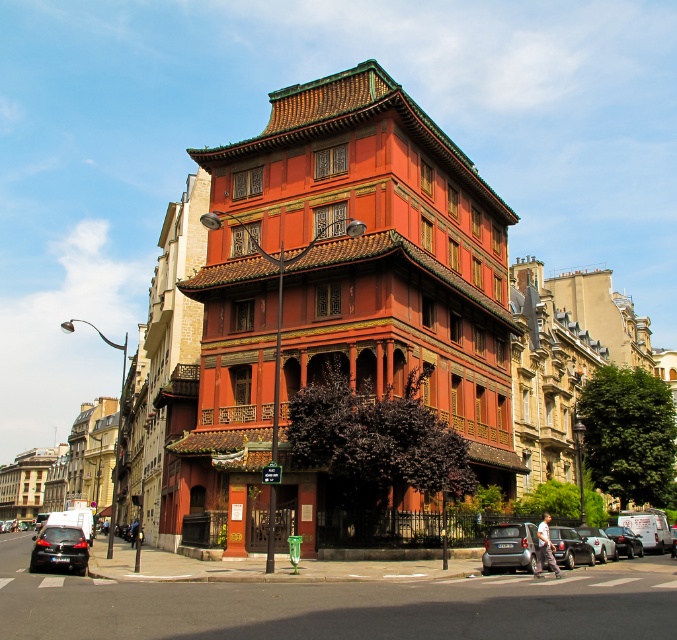
Does matte red wood tower at center lie behind metallic silver car at center?

Yes, matte red wood tower at center is further from the viewer.

Who is positioned more to the right, matte red wood tower at center or metallic silver car at center?

From the viewer's perspective, metallic silver car at center appears more on the right side.

Consider the image. Who is more distant from viewer, (414, 182) or (571, 552)?

Positioned behind is point (414, 182).

Image resolution: width=677 pixels, height=640 pixels. Identify the location of matte red wood tower at center. pos(336,296).

Is matte silver car at lower right shorter than metallic silver van at lower right?

Incorrect, matte silver car at lower right's height does not fall short of metallic silver van at lower right's.

Which is below, matte silver car at lower right or metallic silver van at lower right?

metallic silver van at lower right is lower down.

I want to click on matte silver car at lower right, so click(510, 547).

Does matte red wood tower at center appear on the left side of matte silver car at lower right?

Yes, matte red wood tower at center is to the left of matte silver car at lower right.

Does matte red wood tower at center have a lesser height compared to matte silver car at lower right?

No, matte red wood tower at center is not shorter than matte silver car at lower right.

Is point (240, 448) closer to camera compared to point (523, 556)?

No, it is behind (523, 556).

You are a GUI agent. You are given a task and a screenshot of the screen. Output one action in this format:
    pyautogui.click(x=<x>, y=<y>)
    Task: Click on the matte red wood tower at center
    The height and width of the screenshot is (640, 677).
    Given the screenshot: What is the action you would take?
    pyautogui.click(x=336, y=296)